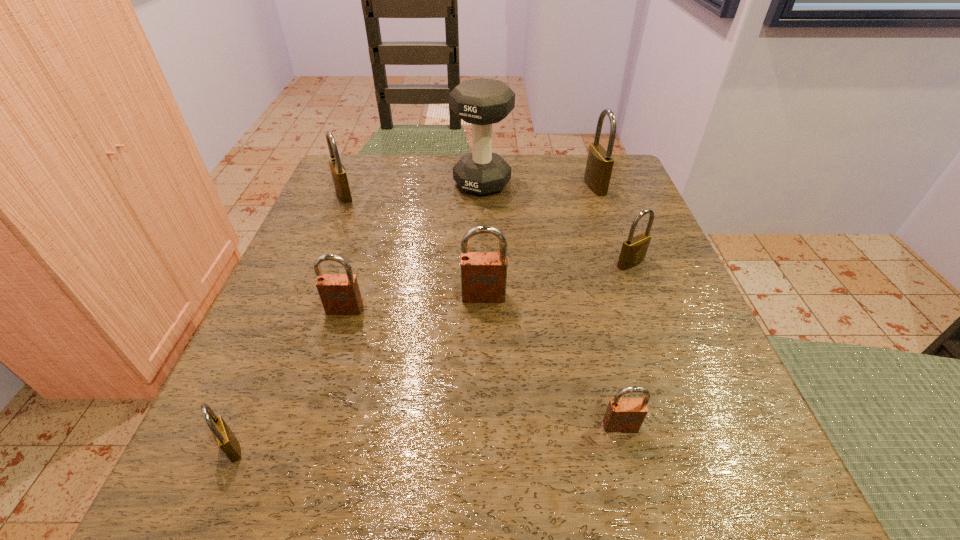
At what (x,y) coordinates should I click in order to perform the action: click on free space between the fourth nearest padlock and the third biggest brass padlock. Please return your answer as a coordinate pair (x, y). The image size is (960, 540). Looking at the image, I should click on (557, 280).

Where is `free spot between the rightmost brown padlock and the third smallest brass padlock`? Image resolution: width=960 pixels, height=540 pixels. free spot between the rightmost brown padlock and the third smallest brass padlock is located at coordinates (482, 310).

Image resolution: width=960 pixels, height=540 pixels. In order to click on free point between the biggest brass padlock and the fourth farthest object in this screenshot , I will do `click(612, 225)`.

Point out which object is positioned as the seventh nearest to the third smallest brass padlock. Please provide its 2D coordinates. Your answer should be formatted as a tuple, i.e. [(x, y)], where the tuple contains the x and y coordinates of a point satisfying the conditions above.

[(623, 415)]

Locate which object ranks seventh in proximity to the second tallest object. Please provide its 2D coordinates. Your answer should be formatted as a tuple, i.e. [(x, y)], where the tuple contains the x and y coordinates of a point satisfying the conditions above.

[(224, 437)]

I want to click on padlock that is the fourth closest to the fourth padlock from left to right, so click(224, 437).

Identify which padlock is located as the sixth nearest to the seventh shortest object. Please provide its 2D coordinates. Your answer should be formatted as a tuple, i.e. [(x, y)], where the tuple contains the x and y coordinates of a point satisfying the conditions above.

[(224, 437)]

This screenshot has height=540, width=960. Find the location of `brass padlock that is the closest to the fourth farthest object`. brass padlock that is the closest to the fourth farthest object is located at coordinates (599, 165).

The image size is (960, 540). Identify the location of brass padlock that is the fourth closest to the tallest object. (224, 437).

Where is `brown padlock that can be found as the second closest to the gray dumbbell`? This screenshot has width=960, height=540. brown padlock that can be found as the second closest to the gray dumbbell is located at coordinates (340, 295).